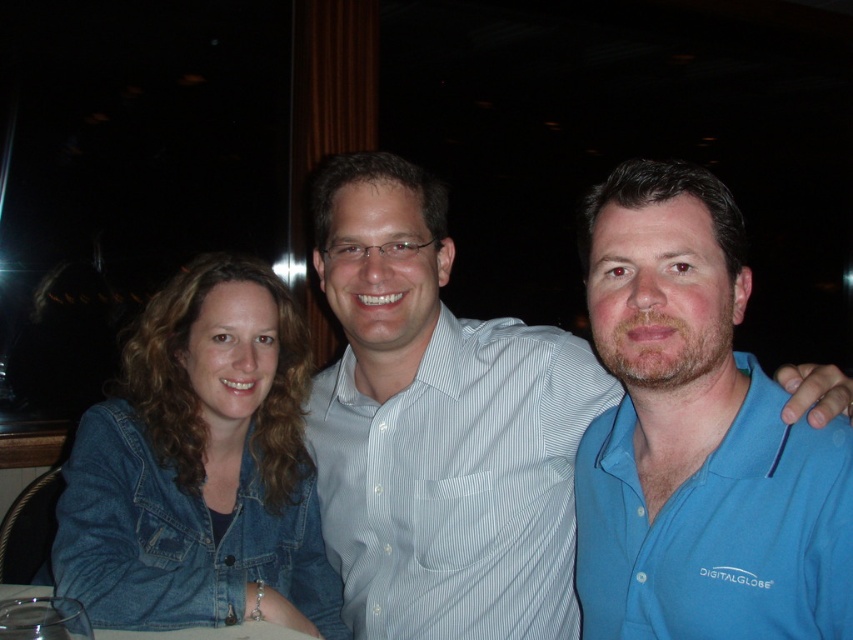
You are a photographer at a social event. You need to decide which of the two shirts, the light blue shirt at center or the blue cotton polo at right, would be easier to capture in a closeup shot focusing on the center of the image. Which one would you choose and why?

The light blue shirt at center is wider than the blue cotton polo at right, so it would be easier to capture in a closeup shot focusing on the center of the image because its larger size allows for more detailed visibility within the frame.

In the image, there are three people sitting together. The person on the left is wearing a denim jacket, the one in the center is wearing a light blue shirt at center, and the person on the right has short dark hair and is wearing bright blue. Based on their positions, which person is sitting exactly in the middle of the group?

The light blue shirt at center is sitting exactly in the middle of the group as it is located at point (438, 426).